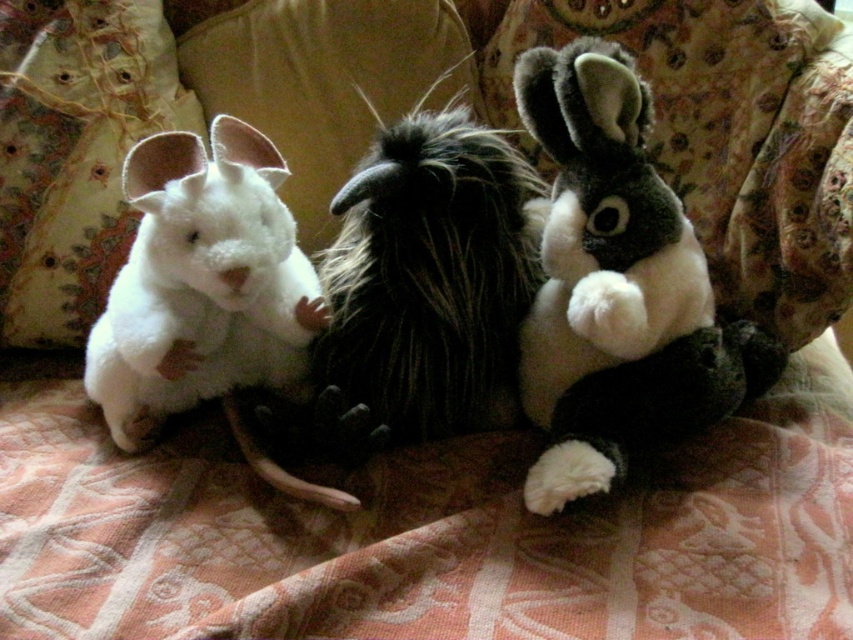
You are organizing a toy store shelf and need to place the fluffy white and black plush rabbit at center and the fluffy black and white plush at center. Given that the shelf has a width of 40 cm, can both toys fit side by side if the rabbit takes up more space?

The fluffy white and black plush rabbit at center is wider than the fluffy black and white plush at center. However, without knowing their exact widths or combined total, we cannot confirm if they fit within 40 cm. More information is needed.

You are trying to place a new plush toy between the fluffy black and white plush at center and the white plush pillow at left. What is the minimum distance you need to maintain between them to ensure the new plush toy fits?

The minimum distance needed is 14.62 inches, as that is the current spacing between the fluffy black and white plush at center and the white plush pillow at left.

You are organizing a childrens room and need to place both the fluffy white and black plush rabbit at center and the fluffy black and white plush at center on a shelf. The shelf has limited vertical space. Which toy should you choose to fit better in the available height?

The fluffy black and white plush at center is shorter than the fluffy white and black plush rabbit at center, so it would fit better in the shelf with limited vertical space.